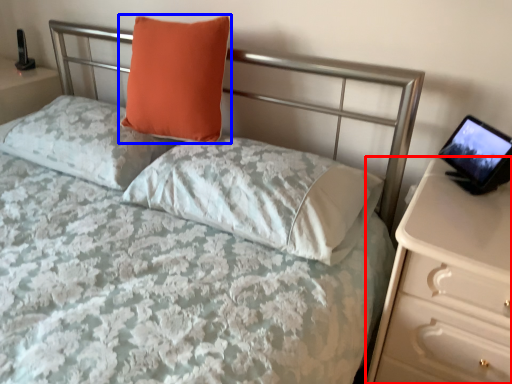
Question: Among these objects, which one is farthest to the camera, nightstand (highlighted by a red box) or pillow (highlighted by a blue box)?

Choices:
 (A) nightstand
 (B) pillow

Answer: (B)